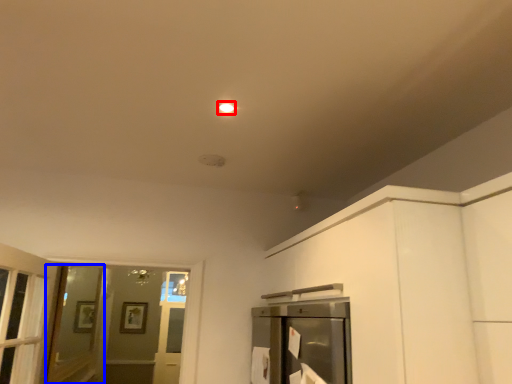
Question: Which point is further to the camera, lighting (highlighted by a red box) or screen door (highlighted by a blue box)?

Choices:
 (A) lighting
 (B) screen door

Answer: (B)